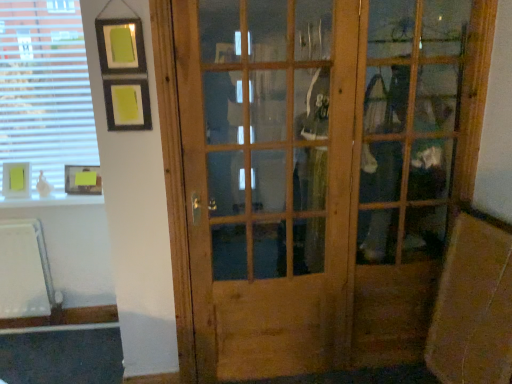
Question: Is matte yellow picture frame at upper left, acting as the first picture frame starting from the left, turned away from wooden door at center?

Choices:
 (A) yes
 (B) no

Answer: (B)

Question: Does matte yellow picture frame at upper left, placed as the second picture frame when sorted from right to left, appear on the left side of wooden door at center?

Choices:
 (A) yes
 (B) no

Answer: (A)

Question: Is the position of matte yellow picture frame at upper left, acting as the first picture frame starting from the left, more distant than that of wooden door at center?

Choices:
 (A) no
 (B) yes

Answer: (B)

Question: From the image's perspective, is matte yellow picture frame at upper left, acting as the first picture frame starting from the left, over wooden door at center?

Choices:
 (A) no
 (B) yes

Answer: (B)

Question: Is matte yellow picture frame at upper left, acting as the first picture frame starting from the left, to the right of wooden door at center from the viewer's perspective?

Choices:
 (A) no
 (B) yes

Answer: (A)

Question: Is point (15, 147) positioned closer to the camera than point (269, 284)?

Choices:
 (A) farther
 (B) closer

Answer: (A)

Question: Considering the positions of white blinds at upper left and wooden door at center in the image, is white blinds at upper left taller or shorter than wooden door at center?

Choices:
 (A) tall
 (B) short

Answer: (B)

Question: Based on their positions, is white blinds at upper left located to the left or right of wooden door at center?

Choices:
 (A) right
 (B) left

Answer: (B)

Question: Based on their sizes in the image, would you say white blinds at upper left is bigger or smaller than wooden door at center?

Choices:
 (A) small
 (B) big

Answer: (A)

Question: Is yellow paper at lower left, the 1th picture frame in the right-to-left sequence, wider or thinner than white blinds at upper left?

Choices:
 (A) thin
 (B) wide

Answer: (B)

Question: From the image's perspective, relative to white blinds at upper left, is yellow paper at lower left, the 1th picture frame in the right-to-left sequence, above or below?

Choices:
 (A) above
 (B) below

Answer: (B)

Question: Considering the positions of point (88, 180) and point (84, 132), is point (88, 180) closer or farther from the camera than point (84, 132)?

Choices:
 (A) farther
 (B) closer

Answer: (B)

Question: In the image, is yellow paper at lower left, the 1th picture frame in the right-to-left sequence, positioned in front of or behind white blinds at upper left?

Choices:
 (A) front
 (B) behind

Answer: (B)

Question: Visually, is matte yellow picture frame at upper left, placed as the second picture frame when sorted from right to left, positioned to the left or to the right of wooden door at center?

Choices:
 (A) right
 (B) left

Answer: (B)

Question: Considering the positions of matte yellow picture frame at upper left, placed as the second picture frame when sorted from right to left, and wooden door at center in the image, is matte yellow picture frame at upper left, placed as the second picture frame when sorted from right to left, wider or thinner than wooden door at center?

Choices:
 (A) wide
 (B) thin

Answer: (A)